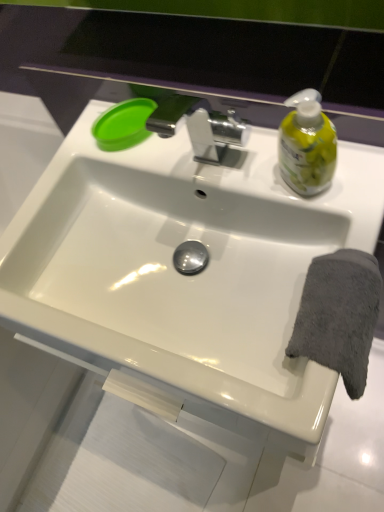
Question: Is point (61, 155) closer or farther from the camera than point (317, 267)?

Choices:
 (A) closer
 (B) farther

Answer: (B)

Question: Visually, is white glossy sink at center positioned to the left or to the right of gray soft towel at right?

Choices:
 (A) right
 (B) left

Answer: (B)

Question: Which is nearer to the green plastic lid at upper left?

Choices:
 (A) white glossy sink at center
 (B) gray soft towel at right

Answer: (A)

Question: Which object is the closest to the gray soft towel at right?

Choices:
 (A) white glossy sink at center
 (B) green plastic lid at upper left

Answer: (A)